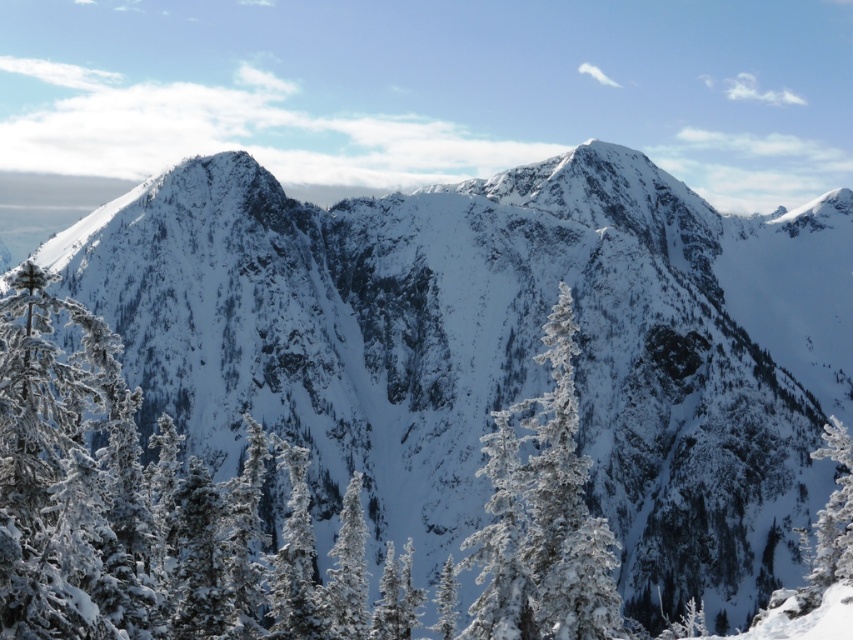
You are standing at the base of the mountain and want to take a photo of both the white frosty tree at center and the white frosty tree at lower right. Which tree should you position yourself to the left of to capture both in your shot?

You should position yourself to the left of the white frosty tree at lower right because the white frosty tree at center is to the left of it, ensuring both are in frame.

You are an observer standing at the base of the mountain. You notice two white frosty trees in the scene. Which tree has a narrower width between the white frosty tree at center and the white frosty tree at lower right?

The white frosty tree at center has a narrower width compared to the white frosty tree at lower right.